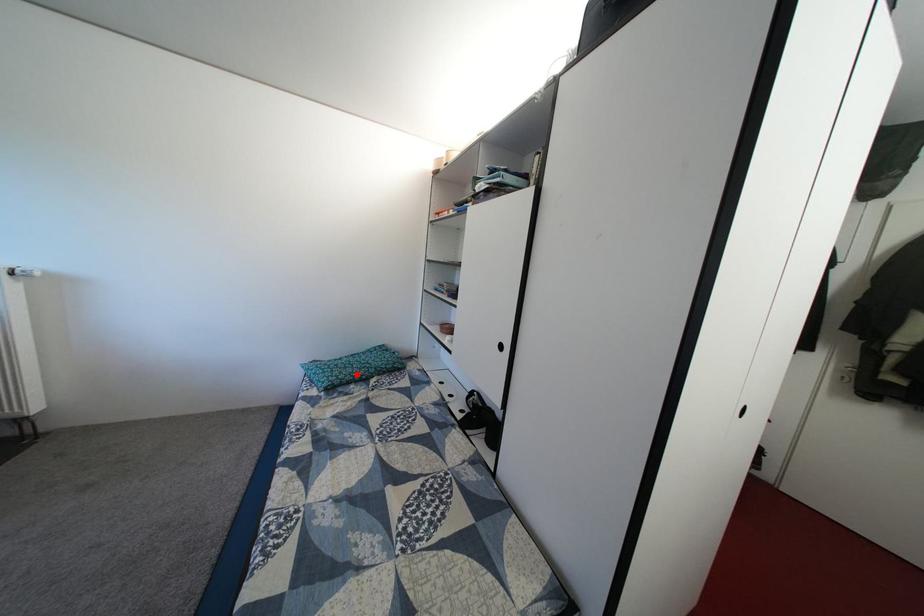
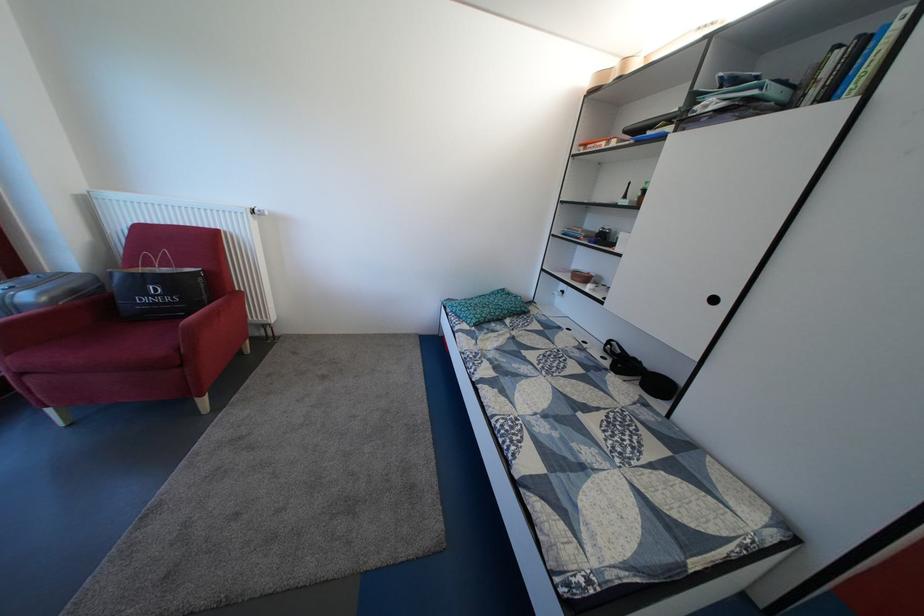
Question: I am providing you with two images of the same scene from different viewpoints. A red point is marked on the first image. At the location where the point appears in image 1, is it still visible in image 2?

Choices:
 (A) Yes
 (B) No

Answer: (A)